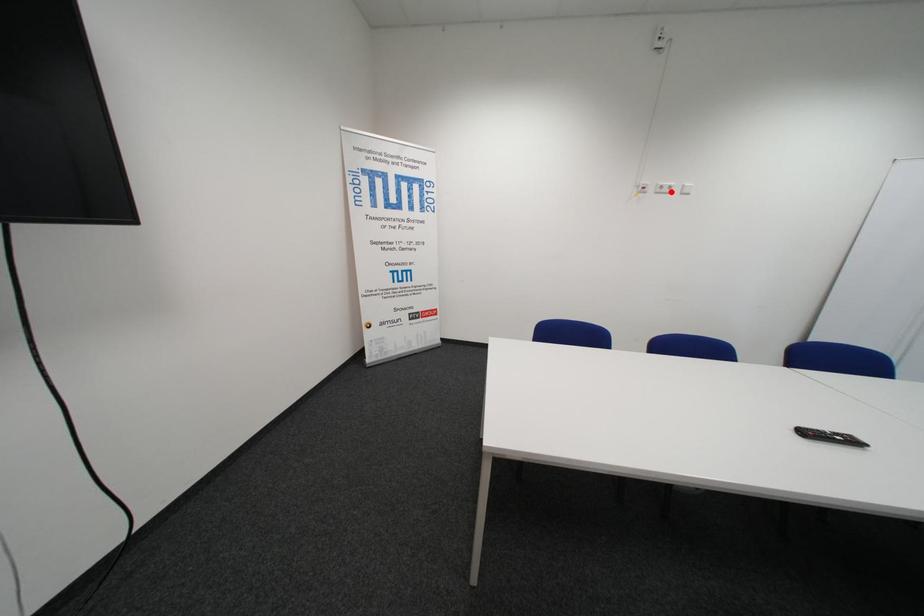
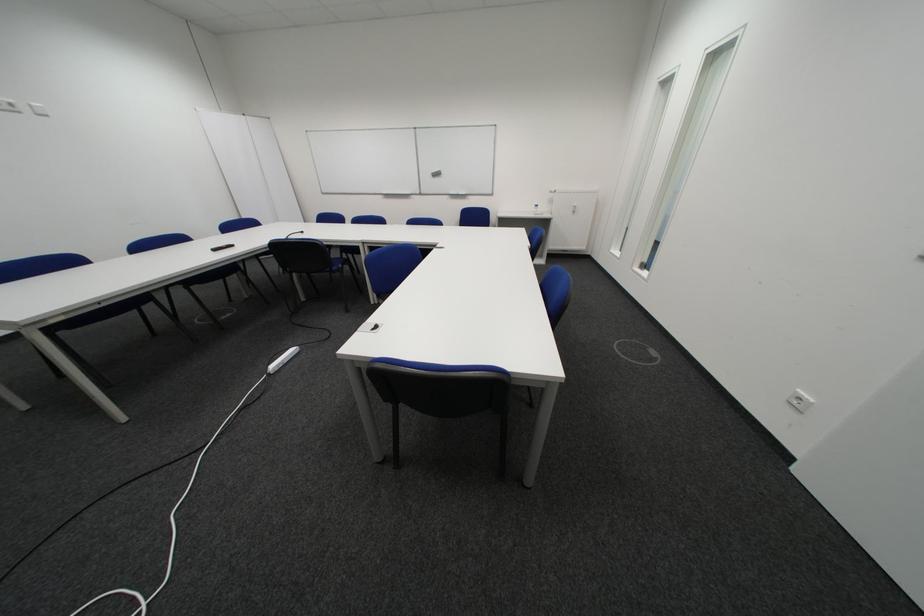
Where in the second image is the point corresponding to the highlighted location from the first image?

(8, 108)